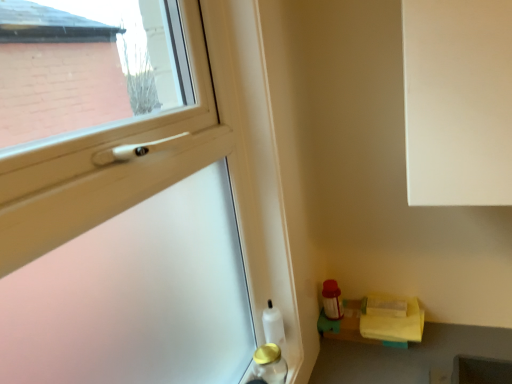
Question: From the image's perspective, would you say gold metallic bottle at lower left, which appears as the first bottle when viewed from the front, is shown under white glossy bottle at lower left, positioned as the second bottle in front-to-back order?

Choices:
 (A) yes
 (B) no

Answer: (A)

Question: Is white glossy bottle at lower left, the 1th bottle viewed from the back, inside gold metallic bottle at lower left, which appears as the 2th bottle when viewed from the back?

Choices:
 (A) yes
 (B) no

Answer: (B)

Question: Does gold metallic bottle at lower left, which appears as the first bottle when viewed from the front, have a lesser width compared to white glossy bottle at lower left, the 1th bottle viewed from the back?

Choices:
 (A) no
 (B) yes

Answer: (A)

Question: Is gold metallic bottle at lower left, which appears as the first bottle when viewed from the front, bigger than white glossy bottle at lower left, positioned as the second bottle in front-to-back order?

Choices:
 (A) yes
 (B) no

Answer: (B)

Question: Considering the relative sizes of gold metallic bottle at lower left, which appears as the first bottle when viewed from the front, and white glossy bottle at lower left, the 1th bottle viewed from the back, in the image provided, is gold metallic bottle at lower left, which appears as the first bottle when viewed from the front, shorter than white glossy bottle at lower left, the 1th bottle viewed from the back,?

Choices:
 (A) no
 (B) yes

Answer: (B)

Question: Is gold metallic bottle at lower left, which appears as the first bottle when viewed from the front, positioned far away from white glossy bottle at lower left, the 1th bottle viewed from the back?

Choices:
 (A) yes
 (B) no

Answer: (B)

Question: Does yellow fabric at lower right have a greater height compared to gold metallic bottle at lower left, which appears as the 2th bottle when viewed from the back?

Choices:
 (A) yes
 (B) no

Answer: (B)

Question: Considering the relative sizes of yellow fabric at lower right and gold metallic bottle at lower left, which appears as the first bottle when viewed from the front, in the image provided, is yellow fabric at lower right shorter than gold metallic bottle at lower left, which appears as the first bottle when viewed from the front,?

Choices:
 (A) no
 (B) yes

Answer: (B)

Question: Can you see yellow fabric at lower right touching gold metallic bottle at lower left, which appears as the first bottle when viewed from the front?

Choices:
 (A) yes
 (B) no

Answer: (B)

Question: Is yellow fabric at lower right to the right of gold metallic bottle at lower left, which appears as the first bottle when viewed from the front, from the viewer's perspective?

Choices:
 (A) no
 (B) yes

Answer: (B)

Question: From a real-world perspective, is yellow fabric at lower right physically above gold metallic bottle at lower left, which appears as the first bottle when viewed from the front?

Choices:
 (A) yes
 (B) no

Answer: (B)

Question: Is yellow fabric at lower right facing towards gold metallic bottle at lower left, which appears as the 2th bottle when viewed from the back?

Choices:
 (A) yes
 (B) no

Answer: (B)

Question: Is gold metallic bottle at lower left, which appears as the 2th bottle when viewed from the back, aimed at yellow fabric at lower right?

Choices:
 (A) no
 (B) yes

Answer: (A)